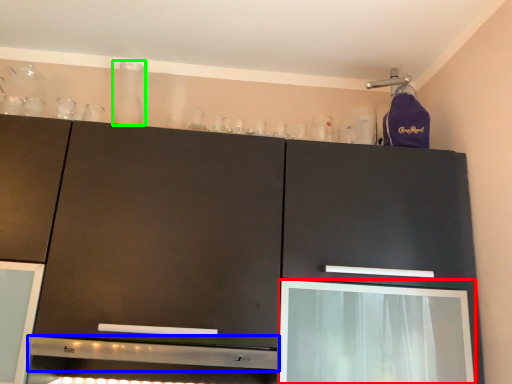
Question: Which object is the closest to the screen door (highlighted by a red box)? Choose among these: exhaust hood (highlighted by a blue box) or glass vase (highlighted by a green box).

Choices:
 (A) exhaust hood
 (B) glass vase

Answer: (A)